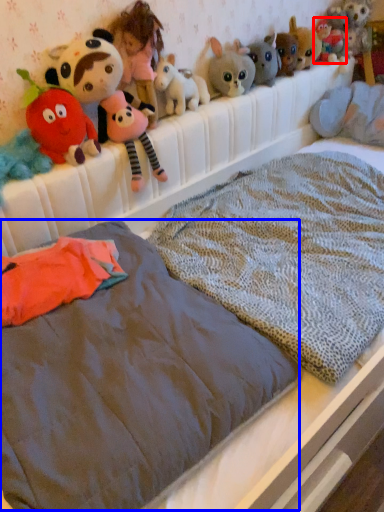
Question: Which of the following is the closest to the observer, toy (highlighted by a red box) or mattress (highlighted by a blue box)?

Choices:
 (A) toy
 (B) mattress

Answer: (B)